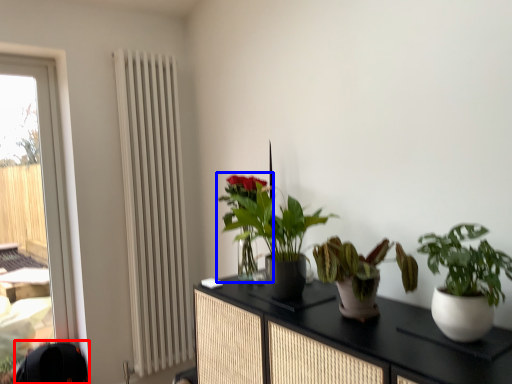
Question: Which object is further to the camera taking this photo, swivel chair (highlighted by a red box) or houseplant (highlighted by a blue box)?

Choices:
 (A) swivel chair
 (B) houseplant

Answer: (A)